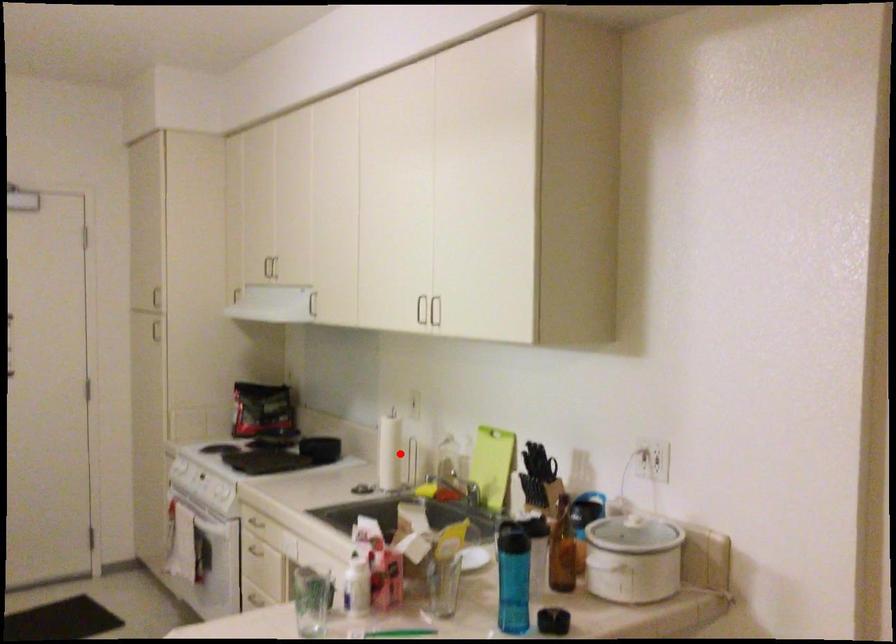
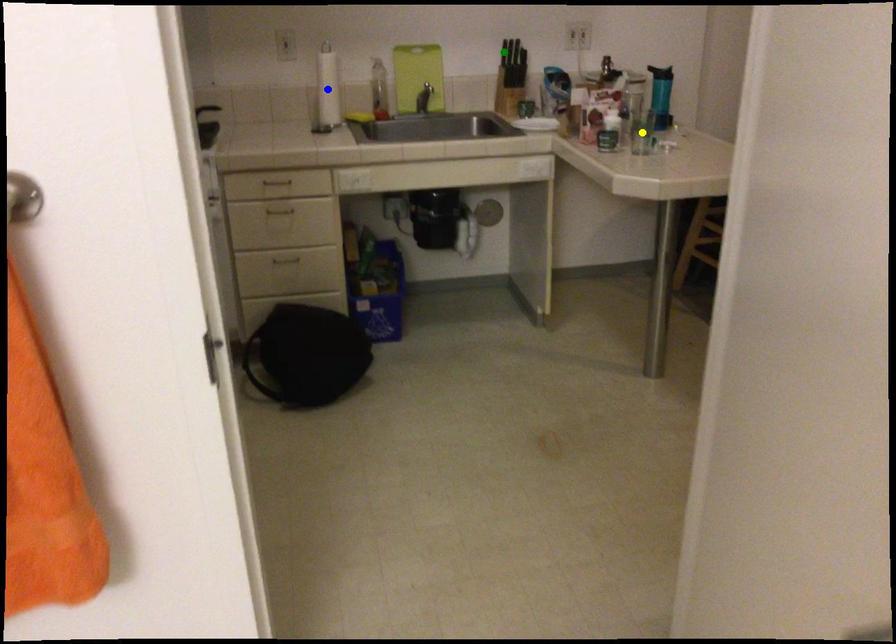
Question: I am providing you with two images of the same scene from different viewpoints. A red point is marked on the first image. You are given multiple points on the second image. Which point in image 2 represents the same 3d spot as the red point in image 1?

Choices:
 (A) blue point
 (B) green point
 (C) yellow point

Answer: (A)